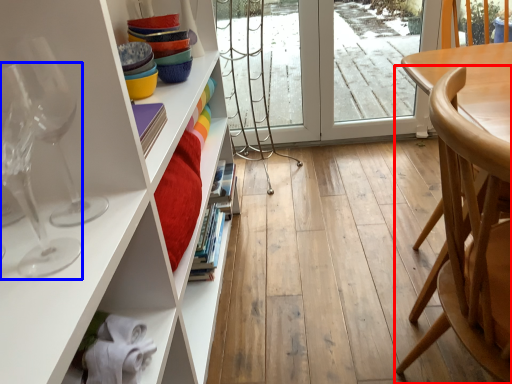
Question: Which object is closer to the camera taking this photo, chair (highlighted by a red box) or wine glass (highlighted by a blue box)?

Choices:
 (A) chair
 (B) wine glass

Answer: (B)